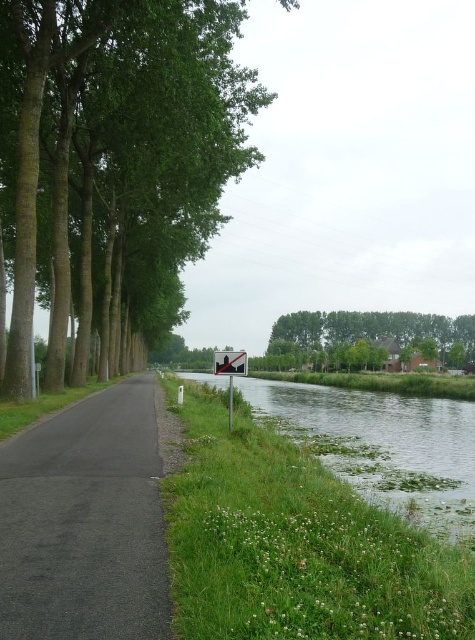
You are a hiker standing at the edge of the green leafy tree at center and want to cross to the green grassy river at center. Considering their sizes, which direction should you walk to reach the river without obstruction?

The green leafy tree at center is larger than the green grassy river at center, so you should walk around the tree to the right side where there is more space to reach the river.

Consider the image. You are standing at point [115,163] in the rural scene. What object is located exactly at this point?

The green leafy tree at center is located exactly at point [115,163].

Consider the image. You are a cyclist approaching the black asphalt road at left and the green leafy trees at center. Which object appears larger in the scene?

The green leafy trees at center appear larger than the black asphalt road at left in the scene.